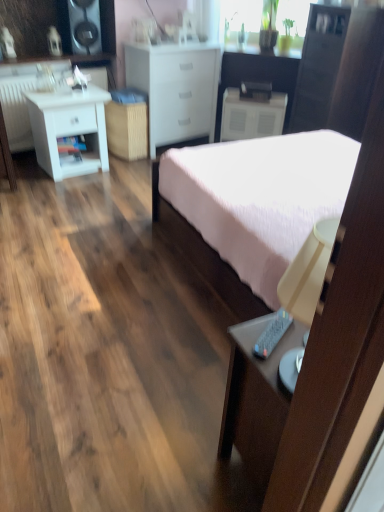
Locate an element on the screen. The height and width of the screenshot is (512, 384). vacant space situated on the left part of pink fabric bed at center is located at coordinates pyautogui.click(x=87, y=266).